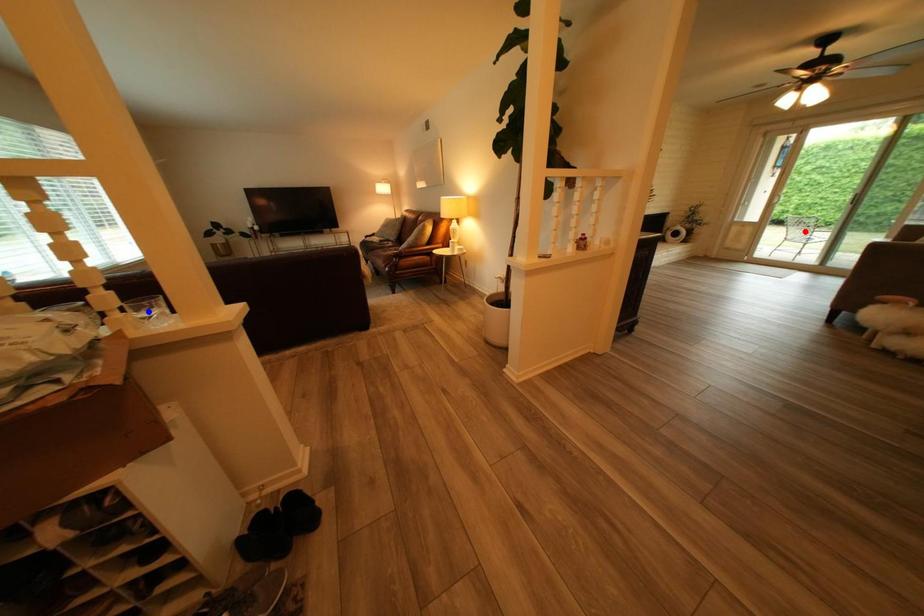
Question: Which of the two points in the image is closer to the camera?

Choices:
 (A) Blue point is closer.
 (B) Red point is closer.

Answer: (A)